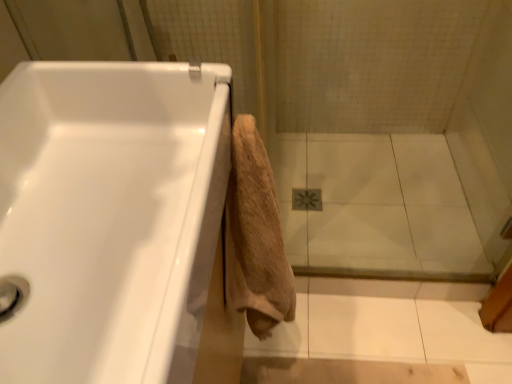
Measure the distance between point (189, 321) and camera.

42.90 centimeters.

This screenshot has height=384, width=512. Describe the element at coordinates (110, 217) in the screenshot. I see `white glossy bathtub at upper left` at that location.

The height and width of the screenshot is (384, 512). What are the coordinates of `white glossy bathtub at upper left` in the screenshot? It's located at (110, 217).

Where is `white glossy bathtub at upper left`? The width and height of the screenshot is (512, 384). white glossy bathtub at upper left is located at coordinates (110, 217).